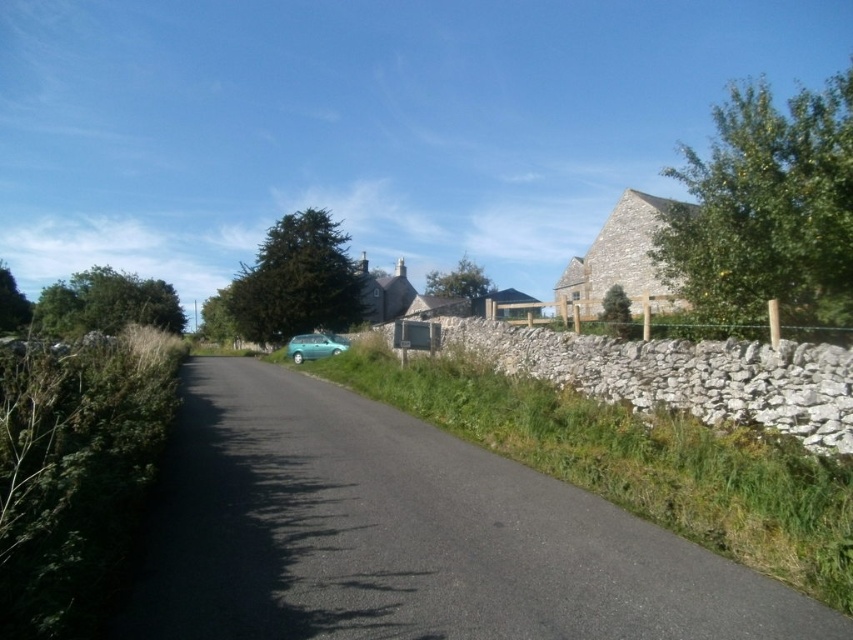
You are driving a teal matte hatchback at center and want to stay within the asphalt road at center. Based on the scene description, can you safely drive in the middle of the road without crossing its edges?

The asphalt road at center is thinner than the teal matte hatchback at center, so driving in the middle might cause parts of the car to go off the road since the road is narrower than the vehicle.

Consider the image. You are driving a teal matte hatchback at center and want to park it on the asphalt road at center. Can you park it there without any obstruction?

The asphalt road at center is positioned under the teal matte hatchback at center, meaning the hatchback is already parked on the road. Since the road is narrow and flanked by dense greenery and a stone wall, there might not be enough space to park safely. However, since the hatchback is already there, it suggests it can be parked there. But the description says the road is narrow, so maybe not. Hmm, need to check the objects description again. Wait, the objects description says the road is under the hatch,

Looking at this image, you are driving a teal matte hatchback at center and want to park it on the asphalt road at center. The parking spot you want is 16 meters long. Can you park the car there?

The teal matte hatchback at center and asphalt road at center are 15.78 meters apart from each other. Since the parking spot is 16 meters long, the car can fit within the parking spot as the distance is sufficient.